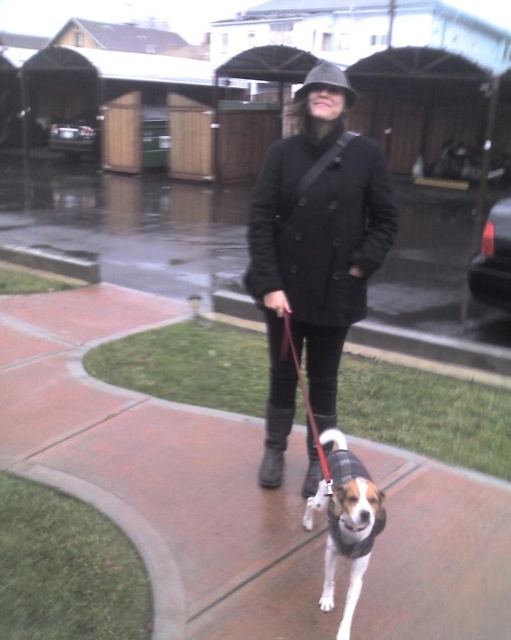
Is point (479, 557) positioned after point (303, 392)?

No.

Is point (173, 301) closer to camera compared to point (323, 454)?

No, it is behind (323, 454).

Locate an element on the screen. brown concrete sidewalk at center is located at coordinates tap(159, 470).

Does brown concrete sidewalk at center appear under white and brown fur at center?

Actually, brown concrete sidewalk at center is above white and brown fur at center.

Is brown concrete sidewalk at center taller than white and brown fur at center?

Correct, brown concrete sidewalk at center is much taller as white and brown fur at center.

Between point (26, 323) and point (382, 508), which one is positioned behind?

Positioned behind is point (26, 323).

The height and width of the screenshot is (640, 511). What are the coordinates of `brown concrete sidewalk at center` in the screenshot? It's located at (159, 470).

Looking at this image, can you confirm if matte black coat at center is wider than white and brown fur at center?

Correct, the width of matte black coat at center exceeds that of white and brown fur at center.

Is matte black coat at center shorter than white and brown fur at center?

In fact, matte black coat at center may be taller than white and brown fur at center.

Is point (297, 308) positioned after point (356, 577)?

Yes.

Find the location of `matte black coat at center`. matte black coat at center is located at coordinates (314, 250).